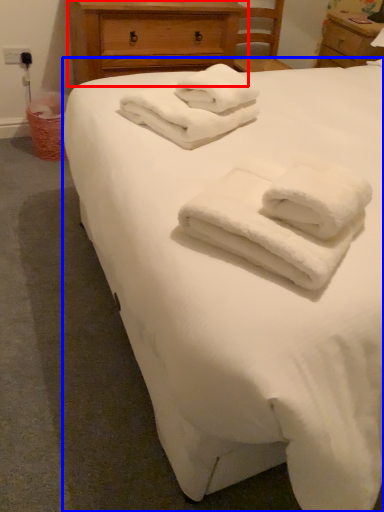
Question: Which object appears closest to the camera in this image, chest of drawers (highlighted by a red box) or bed (highlighted by a blue box)?

Choices:
 (A) chest of drawers
 (B) bed

Answer: (B)